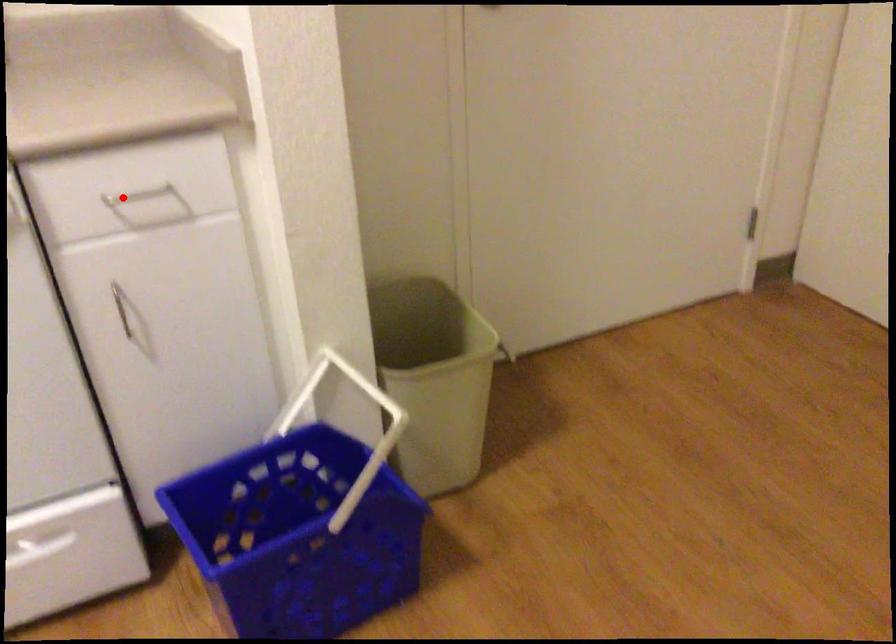
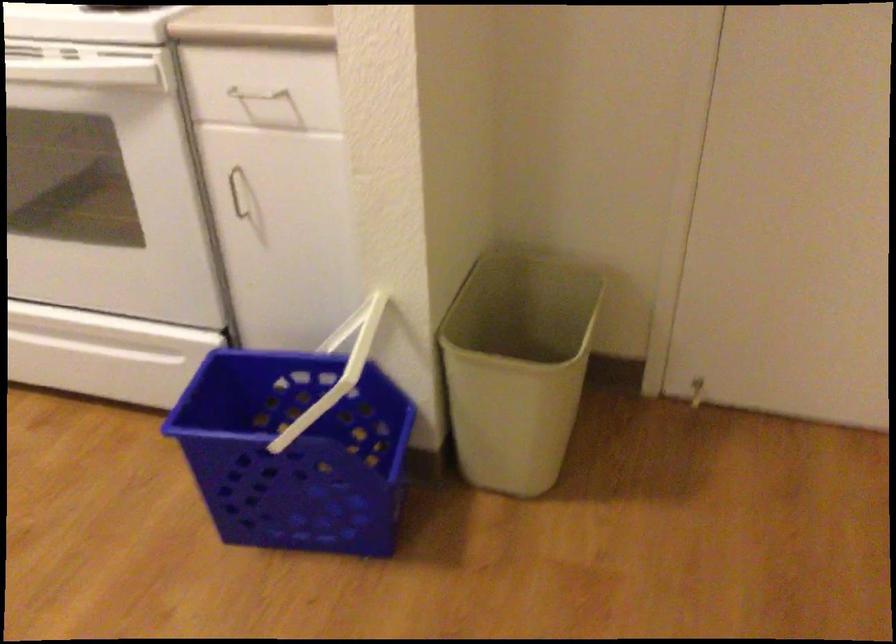
Where in the second image is the point corresponding to the highlighted location from the first image?

(253, 98)